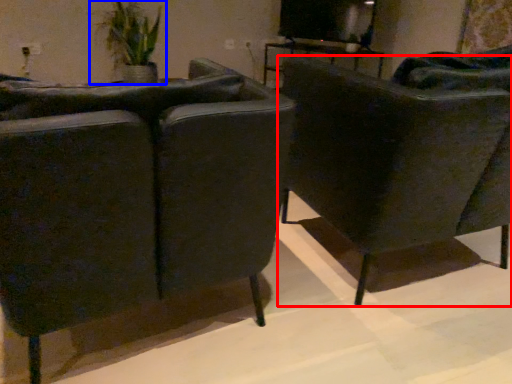
Question: Which of the following is the farthest to the observer, chair (highlighted by a red box) or houseplant (highlighted by a blue box)?

Choices:
 (A) chair
 (B) houseplant

Answer: (B)